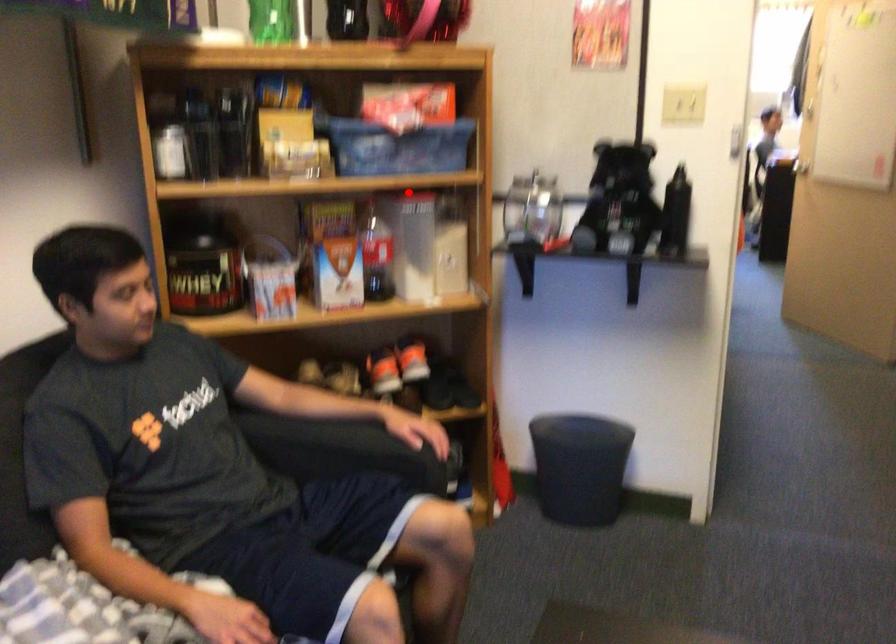
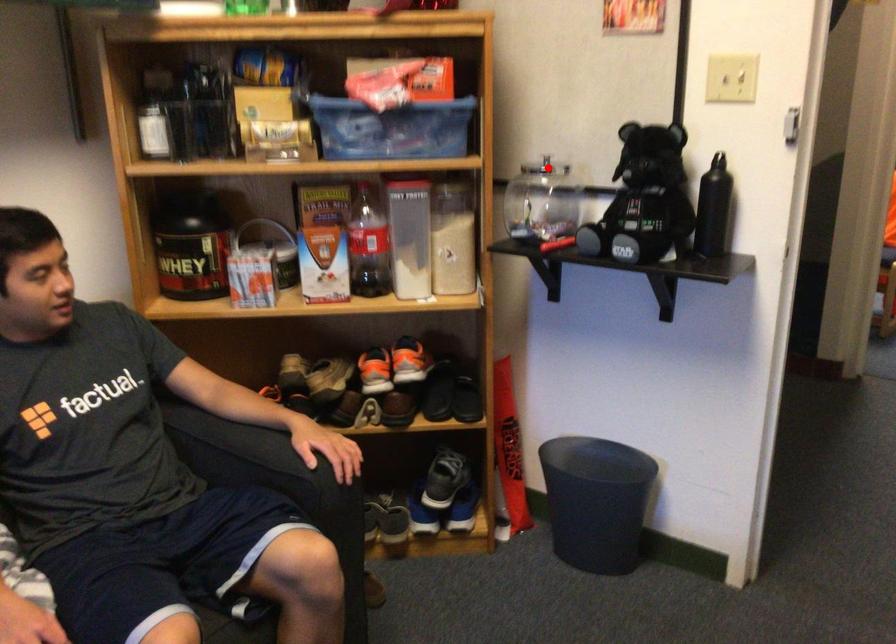
I am providing you with two images of the same scene from different viewpoints. A red point is marked on the first image and another point is marked on the second image. Do the highlighted points in image1 and image2 indicate the same real-world spot?

No